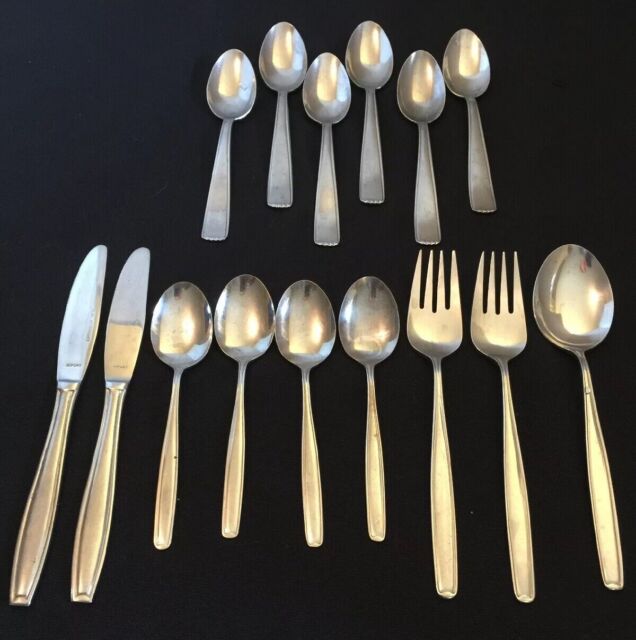
Locate an element on the screen. Image resolution: width=636 pixels, height=640 pixels. spoons on the top row is located at coordinates (240, 83), (280, 51), (328, 75), (366, 49), (427, 84), (466, 60).